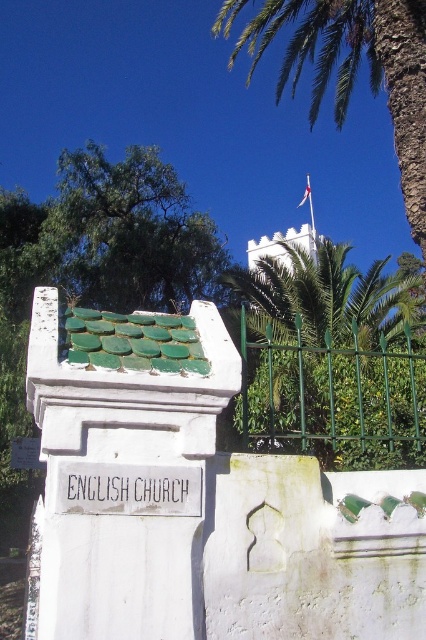
Question: Is green metal fence at upper center in front of green leafy palm tree at upper center?

Choices:
 (A) yes
 (B) no

Answer: (A)

Question: Which object appears closest to the camera in this image?

Choices:
 (A) green leafy palm tree at upper center
 (B) green leafy tree at upper left
 (C) green metal fence at upper center

Answer: (C)

Question: Which of these objects is positioned farthest from the green leafy palm tree at upper center?

Choices:
 (A) green metal fence at upper center
 (B) white fabric flag at upper center

Answer: (B)

Question: Can you confirm if green leafy palm tree at upper center is positioned below white fabric flag at upper center?

Choices:
 (A) yes
 (B) no

Answer: (B)

Question: Considering the relative positions of green metal fence at upper center and green leafy palm tree at upper center in the image provided, where is green metal fence at upper center located with respect to green leafy palm tree at upper center?

Choices:
 (A) left
 (B) right

Answer: (A)

Question: Which of the following is the closest to the observer?

Choices:
 (A) white fabric flag at upper center
 (B) green leafy tree at upper left
 (C) green leafy palm tree at upper center

Answer: (C)